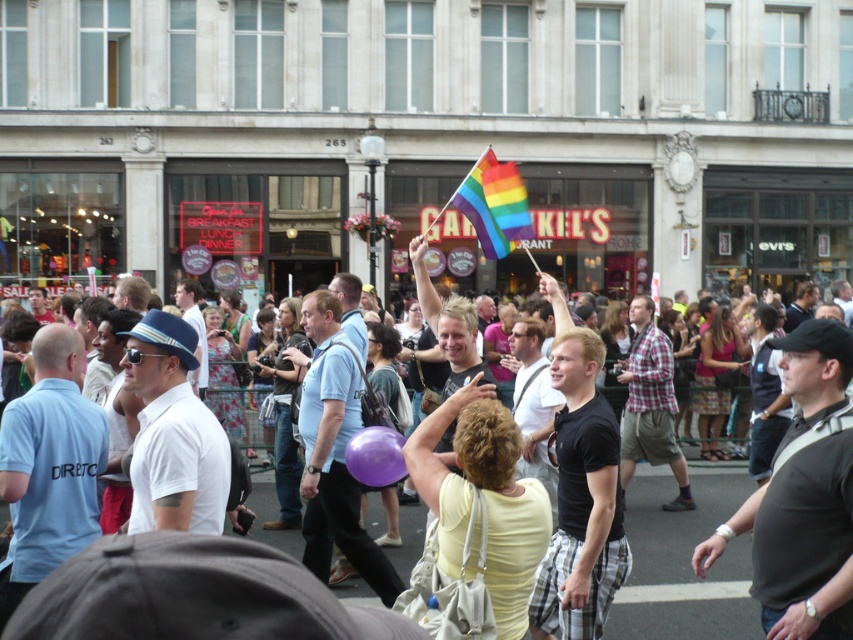
Question: Which point appears farthest from the camera in this image?

Choices:
 (A) (492, 180)
 (B) (677, 616)

Answer: (A)

Question: Does rainbow flag at center have a smaller size compared to rainbow fabric flag at upper center?

Choices:
 (A) no
 (B) yes

Answer: (B)

Question: Can you confirm if rainbow flag at center is positioned to the right of rainbow fabric flag at upper center?

Choices:
 (A) no
 (B) yes

Answer: (A)

Question: Does rainbow flag at center have a smaller size compared to rainbow fabric flag at upper center?

Choices:
 (A) no
 (B) yes

Answer: (B)

Question: Which object appears farthest from the camera in this image?

Choices:
 (A) rainbow fabric flag at upper center
 (B) rainbow flag at center

Answer: (A)

Question: Which point is farther from the camera taking this photo?

Choices:
 (A) (698, 488)
 (B) (486, 188)

Answer: (A)